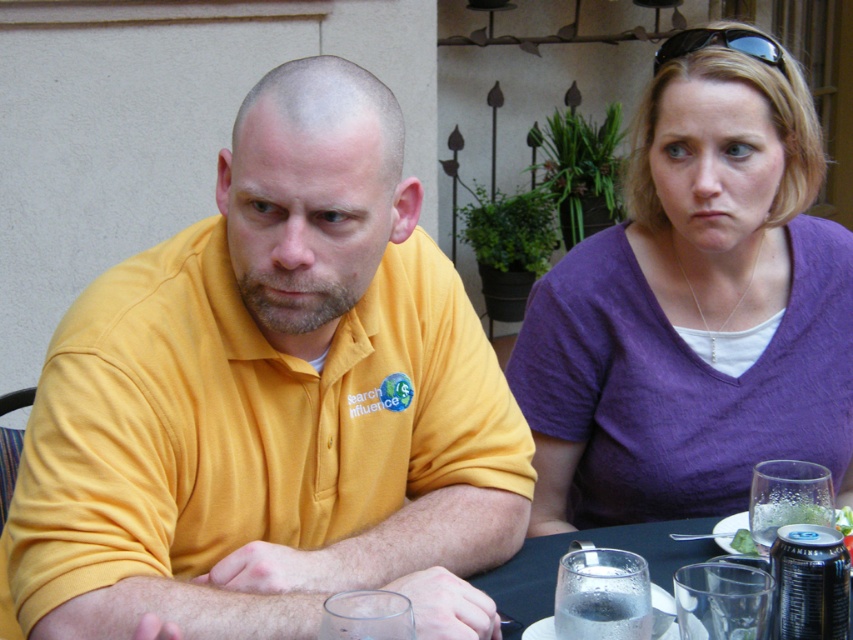
Question: Estimate the real-world distances between objects in this image. Which object is farther from the clear glass at table?

Choices:
 (A) yellow cotton shirt at left
 (B) purple cotton shirt at upper right

Answer: (B)

Question: Which of these objects is positioned closest to the yellow cotton shirt at left?

Choices:
 (A) green leafy vegetable at lower right
 (B) clear glass at table
 (C) purple cotton shirt at upper right

Answer: (B)

Question: Which point appears closest to the camera in this image?

Choices:
 (A) pyautogui.click(x=337, y=508)
 (B) pyautogui.click(x=741, y=35)

Answer: (A)

Question: Can you confirm if metallic silver can at lower right is positioned below sunglasses at upper right?

Choices:
 (A) no
 (B) yes

Answer: (B)

Question: Does metallic silver can at lower right come in front of clear glass at table?

Choices:
 (A) no
 (B) yes

Answer: (A)

Question: Can you confirm if yellow cotton shirt at left is smaller than green leafy vegetable at lower right?

Choices:
 (A) yes
 (B) no

Answer: (B)